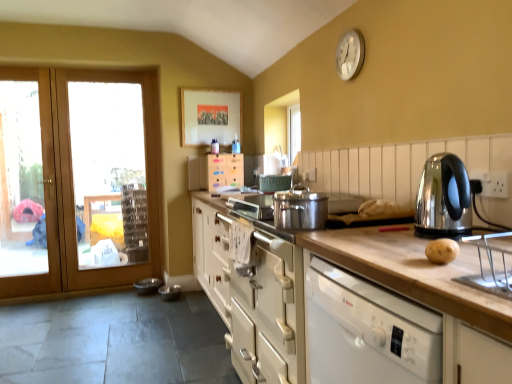
Question: In the image, is white metallic clock at upper right positioned in front of or behind wooden door at left?

Choices:
 (A) front
 (B) behind

Answer: (A)

Question: From the image's perspective, is white metallic clock at upper right positioned above or below wooden door at left?

Choices:
 (A) below
 (B) above

Answer: (B)

Question: Based on their relative distances, which object is nearer to the wooden door at left?

Choices:
 (A) shiny metallic kettle at right
 (B) clear glass door at left
 (C) matte wooden picture frame at upper center
 (D) clear glass door at left
 (E) white metallic clock at upper right

Answer: (B)

Question: Based on their relative distances, which object is nearer to the wooden door at left?

Choices:
 (A) white wood cabinet at center, which is the 1th cabinetry from left to right
 (B) clear glass door at left
 (C) shiny metallic kettle at right
 (D) white matte cabinet at center, which ranks as the second cabinetry in left-to-right order
 (E) white metallic clock at upper right

Answer: (B)